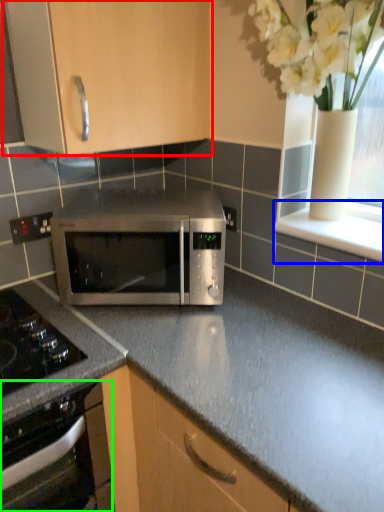
Question: Estimate the real-world distances between objects in this image. Which object is closer to cabinetry (highlighted by a red box), window sill (highlighted by a blue box) or oven (highlighted by a green box)?

Choices:
 (A) window sill
 (B) oven

Answer: (A)